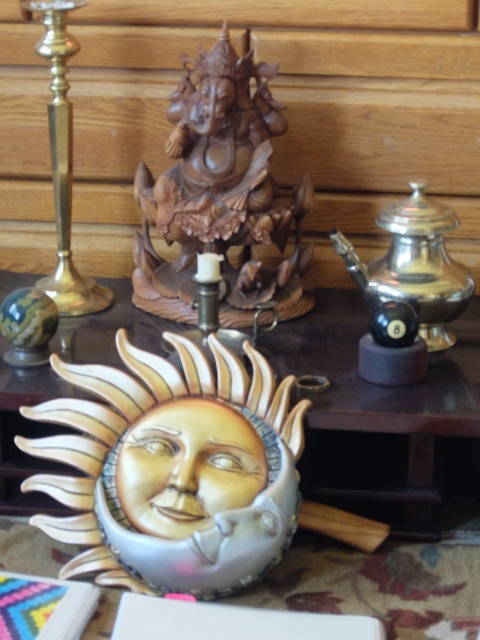
Question: Which point appears farthest from the camera in this image?

Choices:
 (A) (49, 280)
 (B) (206, 112)
 (C) (199, 428)
 (D) (166, 328)

Answer: (A)

Question: Which of these objects is positioned farthest from the silver metallic teapot at right?

Choices:
 (A) porcelain face at center
 (B) brass/copper candlestick at left
 (C) wooden statue at center

Answer: (B)

Question: Is porcelain sun face at center to the left of wooden statue at center from the viewer's perspective?

Choices:
 (A) no
 (B) yes

Answer: (B)

Question: Does porcelain face at center lie in front of brass/copper candlestick at left?

Choices:
 (A) yes
 (B) no

Answer: (A)

Question: Estimate the real-world distances between objects in this image. Which object is farther from the porcelain sun face at center?

Choices:
 (A) wooden statue at center
 (B) porcelain face at center
 (C) silver metallic teapot at right

Answer: (A)

Question: Does porcelain sun face at center have a greater width compared to brass/copper candlestick at left?

Choices:
 (A) yes
 (B) no

Answer: (A)